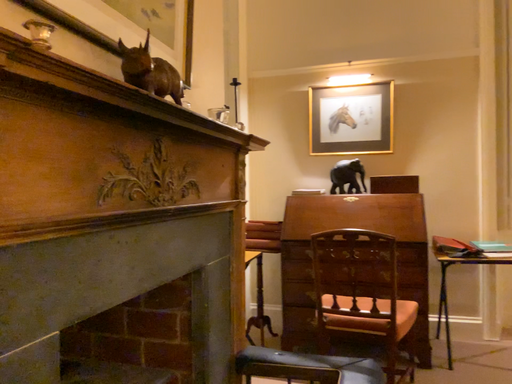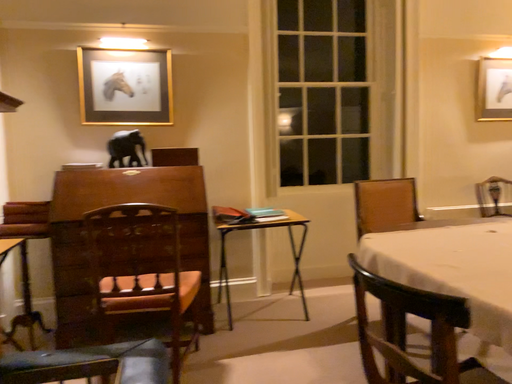
Question: Which way did the camera rotate in the video?

Choices:
 (A) rotated left
 (B) rotated right

Answer: (B)